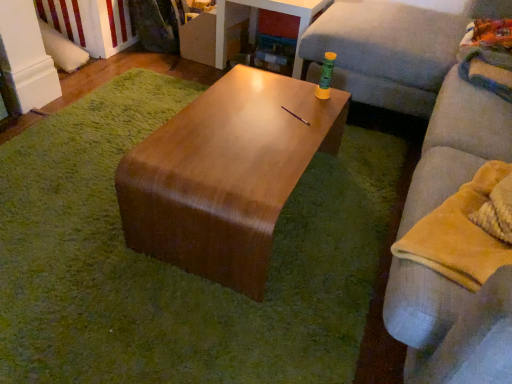
You are a GUI agent. You are given a task and a screenshot of the screen. Output one action in this format:
    pyautogui.click(x=<x>, y=<y>)
    Task: Click on the vacant point to the right of shiny brown coffee table at center
    
    Given the screenshot: What is the action you would take?
    pyautogui.click(x=351, y=209)